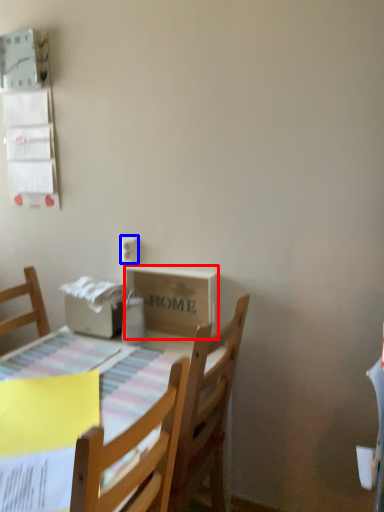
Question: Which object appears farthest to the camera in this image, cardboard box (highlighted by a red box) or electric outlet (highlighted by a blue box)?

Choices:
 (A) cardboard box
 (B) electric outlet

Answer: (B)